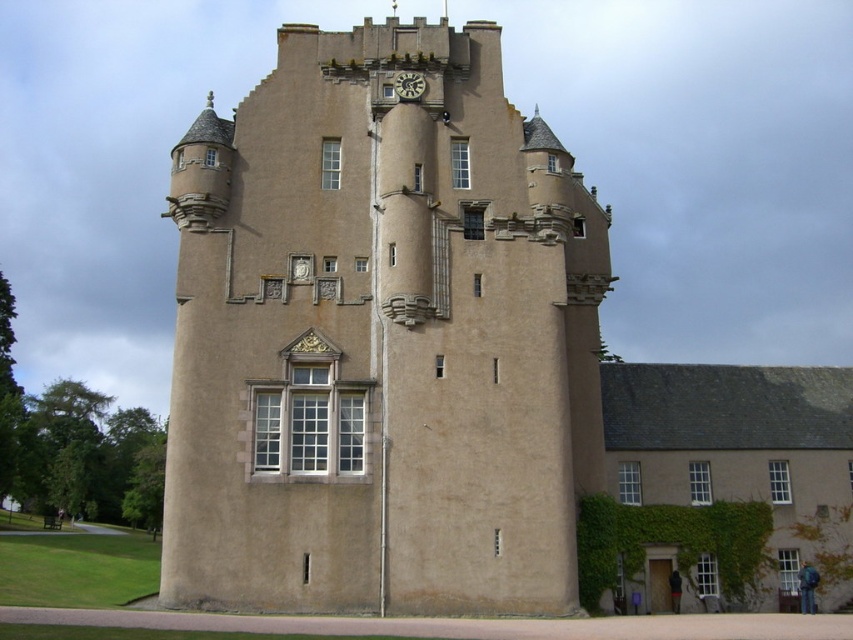
Question: Is beige stone tower at center smaller than matte stone clock at upper center?

Choices:
 (A) no
 (B) yes

Answer: (A)

Question: Among these objects, which one is farthest from the camera?

Choices:
 (A) beige stone tower at center
 (B) matte stone clock at upper center

Answer: (B)

Question: Does beige stone tower at center appear on the left side of matte stone clock at upper center?

Choices:
 (A) yes
 (B) no

Answer: (A)

Question: Can you confirm if beige stone tower at center is wider than matte stone clock at upper center?

Choices:
 (A) no
 (B) yes

Answer: (B)